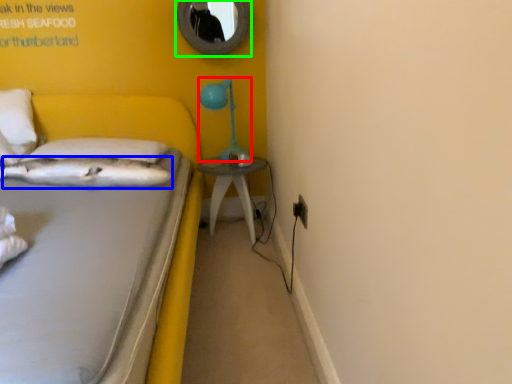
Question: Based on their relative distances, which object is nearer to table lamp (highlighted by a red box)? Choose from pillow (highlighted by a blue box) and mirror (highlighted by a green box).

Choices:
 (A) pillow
 (B) mirror

Answer: (B)